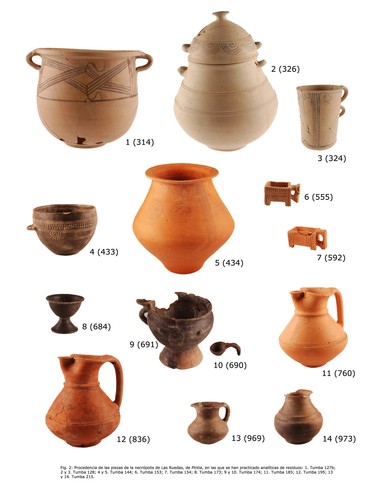
Identify the location of handles on cup upper right. This screenshot has height=500, width=376. (346, 92), (343, 110).